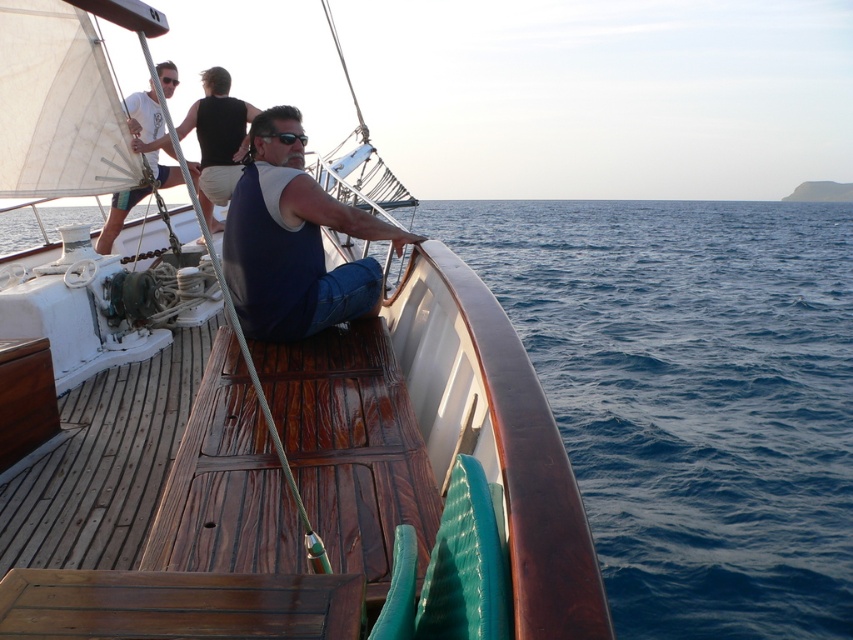
Is point (523, 611) behind point (196, 136)?

That is False.

Can you confirm if wooden deck at center is shorter than dark blue sleeveless shirt at upper center?

Incorrect, wooden deck at center's height does not fall short of dark blue sleeveless shirt at upper center's.

Between point (263, 465) and point (227, 180), which one is positioned in front?

Point (263, 465)

Where is `wooden deck at center`? This screenshot has height=640, width=853. wooden deck at center is located at coordinates (316, 449).

Is wooden deck at center further to camera compared to blue denim jeans at center?

No, it is not.

Can you confirm if wooden deck at center is wider than blue denim jeans at center?

Answer: Correct, the width of wooden deck at center exceeds that of blue denim jeans at center.

In order to click on wooden deck at center in this screenshot , I will do `click(316, 449)`.

This screenshot has width=853, height=640. I want to click on wooden deck at center, so click(x=316, y=449).

From the picture: Can you confirm if wooden deck at center is smaller than white fabric sail at upper left?

No, wooden deck at center is not smaller than white fabric sail at upper left.

Which is in front, point (392, 449) or point (111, 232)?

Point (392, 449) is more forward.

Does point (408, 451) come closer to viewer compared to point (126, 102)?

That is True.

Find the location of a particular element. This screenshot has width=853, height=640. wooden deck at center is located at coordinates (316, 449).